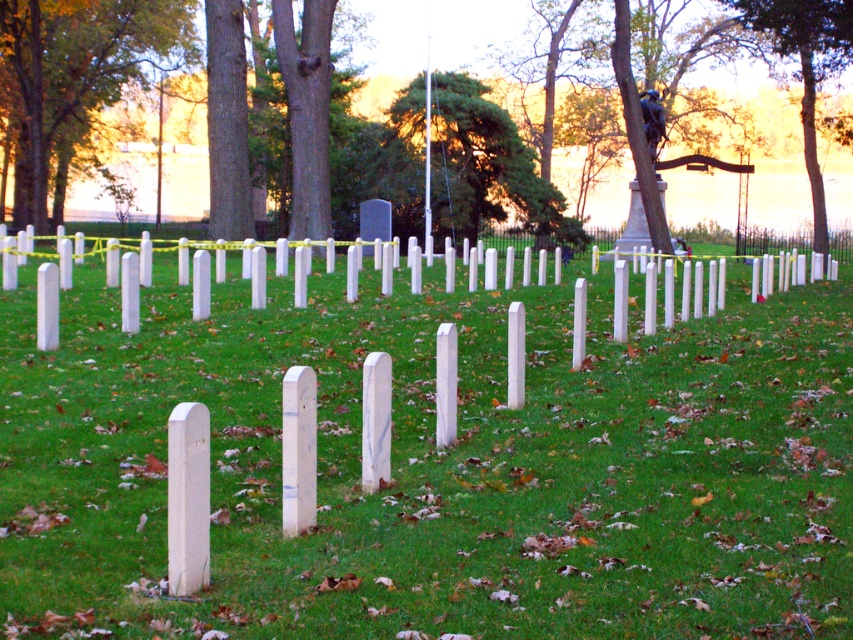
You are a bird seeking shelter and want to find the tallest tree to perch on. Which tree between the green leafy tree at upper left and the green leafy tree at center would you choose?

The green leafy tree at upper left is taller than the green leafy tree at center, so the bird should choose the green leafy tree at upper left to perch on.

You are standing in the cemetery and want to place a small memorial wreath exactly where the white smooth grass at center and green leafy tree at upper left are aligned. Based on their positions, which object should you use as a reference point to ensure the wreath is placed correctly?

The white smooth grass at center is positioned on the right side of the green leafy tree at upper left, so you should use the green leafy tree at upper left as the reference point to align the wreath correctly.

You are standing in the cemetery and want to take a photo of the green leafy tree at upper left. Which direction should you face to ensure the tree is in the frame?

You should face the upper left direction to capture the green leafy tree at upper left in your photo, as it is located at the 2D coordinates point (78, 76).